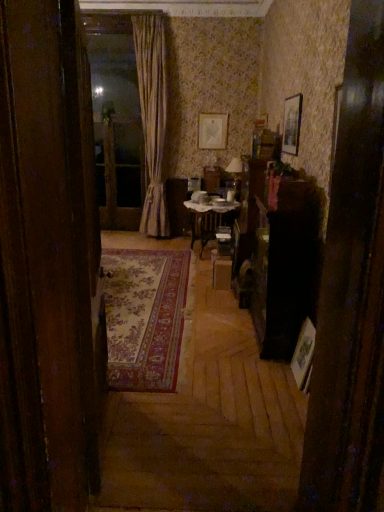
Question: Are matte gold picture frame at upper center, the third picture frame positioned from the bottom, and wooden picture frame at right, placed as the 2th picture frame when sorted from right to left, making contact?

Choices:
 (A) yes
 (B) no

Answer: (B)

Question: Is matte gold picture frame at upper center, which is the third picture frame from front to back, looking in the opposite direction of wooden picture frame at right, the 3th picture frame from the back?

Choices:
 (A) no
 (B) yes

Answer: (A)

Question: From a real-world perspective, is matte gold picture frame at upper center, which is the third picture frame in right-to-left order, physically above wooden picture frame at right, arranged as the third picture frame when viewed from the top?

Choices:
 (A) yes
 (B) no

Answer: (A)

Question: Is matte gold picture frame at upper center, which ranks as the first picture frame in back-to-front order, positioned beyond the bounds of wooden picture frame at right, the 3th picture frame from the back?

Choices:
 (A) no
 (B) yes

Answer: (B)

Question: Considering the relative positions of matte gold picture frame at upper center, placed as the first picture frame when sorted from left to right, and wooden picture frame at right, which appears as the 1th picture frame when ordered from the bottom, in the image provided, is matte gold picture frame at upper center, placed as the first picture frame when sorted from left to right, in front of wooden picture frame at right, which appears as the 1th picture frame when ordered from the bottom,?

Choices:
 (A) yes
 (B) no

Answer: (B)

Question: In the image, is matte gold picture frame at upper center, the third picture frame positioned from the bottom, positioned in front of or behind wooden picture frame at upper right, positioned as the first picture frame in right-to-left order?

Choices:
 (A) behind
 (B) front

Answer: (A)

Question: Is matte gold picture frame at upper center, which is the third picture frame from front to back, inside or outside of wooden picture frame at upper right, the 2th picture frame viewed from the top?

Choices:
 (A) outside
 (B) inside

Answer: (A)

Question: From their relative heights in the image, would you say matte gold picture frame at upper center, the third picture frame positioned from the bottom, is taller or shorter than wooden picture frame at upper right, which is counted as the second picture frame, starting from the bottom?

Choices:
 (A) short
 (B) tall

Answer: (B)

Question: Considering the positions of point (225, 116) and point (284, 99), is point (225, 116) closer or farther from the camera than point (284, 99)?

Choices:
 (A) closer
 (B) farther

Answer: (B)

Question: From their relative heights in the image, would you say transparent glass screen door at upper center is taller or shorter than wooden door at left?

Choices:
 (A) tall
 (B) short

Answer: (B)

Question: Looking at their shapes, would you say transparent glass screen door at upper center is wider or thinner than wooden door at left?

Choices:
 (A) thin
 (B) wide

Answer: (A)

Question: Would you say transparent glass screen door at upper center is to the left or to the right of wooden door at left in the picture?

Choices:
 (A) left
 (B) right

Answer: (A)

Question: Considering the positions of point (112, 121) and point (3, 18), is point (112, 121) closer or farther from the camera than point (3, 18)?

Choices:
 (A) farther
 (B) closer

Answer: (A)

Question: In terms of height, does wooden picture frame at right, which ranks as the 1th picture frame in front-to-back order, look taller or shorter compared to wooden picture frame at upper right, arranged as the 2th picture frame when viewed from the back?

Choices:
 (A) tall
 (B) short

Answer: (B)

Question: From the image's perspective, is wooden picture frame at right, which appears as the 1th picture frame when ordered from the bottom, located above or below wooden picture frame at upper right, which appears as the 2th picture frame when viewed from the front?

Choices:
 (A) above
 (B) below

Answer: (B)